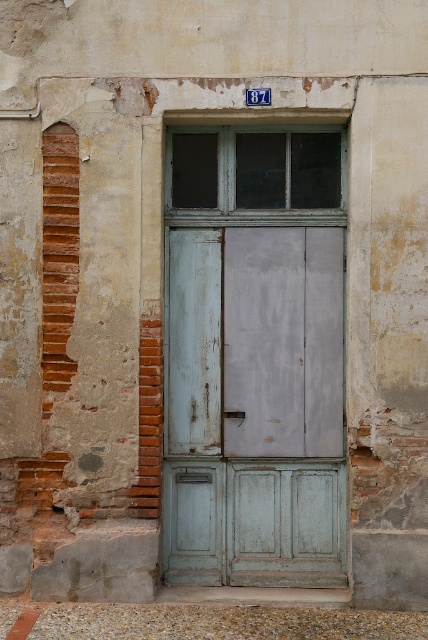
Question: Which point appears farthest from the camera in this image?

Choices:
 (A) (303, 196)
 (B) (329, 237)

Answer: (A)

Question: Among these points, which one is farthest from the camera?

Choices:
 (A) (341, 563)
 (B) (326, 134)

Answer: (A)

Question: Which object is closer to the camera taking this photo?

Choices:
 (A) matte gray wooden window at center
 (B) light blue wooden door at center

Answer: (B)

Question: Is light blue wooden door at center bigger than matte gray wooden window at center?

Choices:
 (A) no
 (B) yes

Answer: (B)

Question: Does light blue wooden door at center have a lesser width compared to matte gray wooden window at center?

Choices:
 (A) yes
 (B) no

Answer: (B)

Question: Is light blue wooden door at center smaller than matte gray wooden window at center?

Choices:
 (A) yes
 (B) no

Answer: (B)